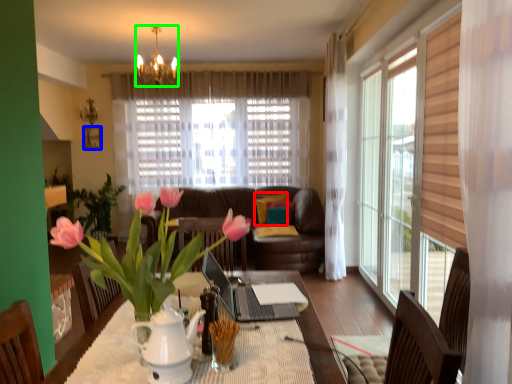
Question: Estimate the real-world distances between objects in this image. Which object is closer to pillow (highlighted by a red box), picture frame (highlighted by a blue box) or lamp (highlighted by a green box)?

Choices:
 (A) picture frame
 (B) lamp

Answer: (B)